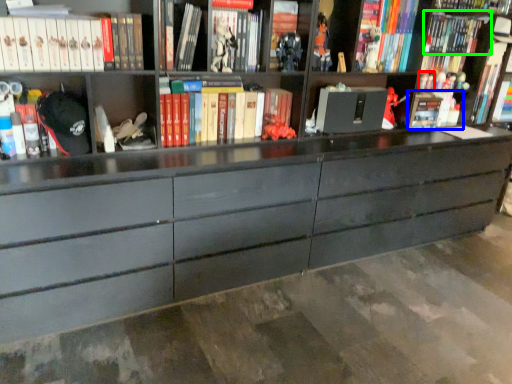
Question: Estimate the real-world distances between objects in this image. Which object is farther from toy (highlighted by a red box), book (highlighted by a blue box) or book (highlighted by a green box)?

Choices:
 (A) book
 (B) book

Answer: (B)